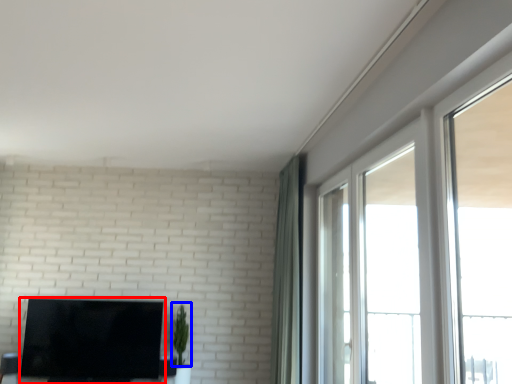
Question: Which point is further to the camera, television (highlighted by a red box) or plant (highlighted by a blue box)?

Choices:
 (A) television
 (B) plant

Answer: (B)